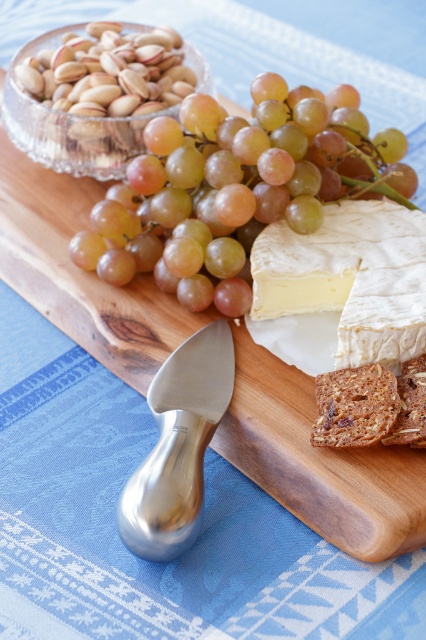
Question: Is white creamy cheese at center below translucent glass bowl at upper left?

Choices:
 (A) yes
 (B) no

Answer: (A)

Question: Does green matte grape at center have a greater width compared to white creamy cheese at center?

Choices:
 (A) yes
 (B) no

Answer: (A)

Question: Which object is farther from the camera taking this photo?

Choices:
 (A) translucent glass bowl at upper left
 (B) white creamy cheese at center

Answer: (A)

Question: Considering the real-world distances, which object is closest to the translucent glass bowl at upper left?

Choices:
 (A) white creamy cheese at center
 (B) green matte grape at center

Answer: (B)

Question: Is green matte grape at center thinner than translucent glass bowl at upper left?

Choices:
 (A) yes
 (B) no

Answer: (B)

Question: Which of the following is the farthest from the observer?

Choices:
 (A) green matte grape at center
 (B) white creamy cheese at center
 (C) translucent glass bowl at upper left

Answer: (C)